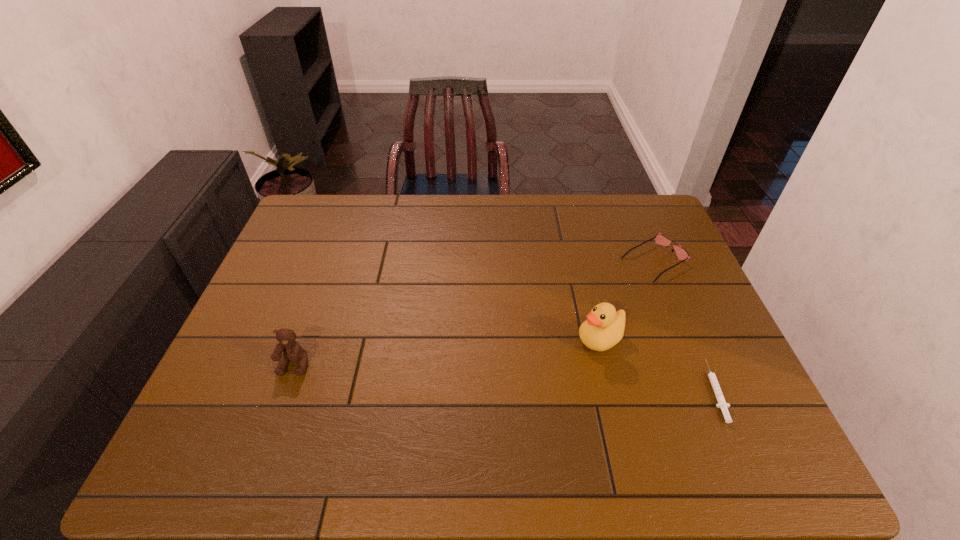
The width and height of the screenshot is (960, 540). What are the coordinates of `vacant point located between the second tallest object and the shortest object` in the screenshot? It's located at (504, 377).

This screenshot has width=960, height=540. Identify the location of vacant space that is in between the tallest object and the teddy bear. (447, 352).

I want to click on free spot between the second shortest object and the duck, so click(x=627, y=300).

The image size is (960, 540). I want to click on free space between the duck and the sunglasses, so click(627, 300).

Locate an element on the screen. vacant region between the duck and the second tallest object is located at coordinates (447, 352).

This screenshot has width=960, height=540. What are the coordinates of `free space between the duck and the teddy bear` in the screenshot? It's located at (447, 352).

Choose which object is the nearest neighbor to the duck. Please provide its 2D coordinates. Your answer should be formatted as a tuple, i.e. [(x, y)], where the tuple contains the x and y coordinates of a point satisfying the conditions above.

[(722, 404)]

Select which object appears as the third closest to the syringe. Please provide its 2D coordinates. Your answer should be formatted as a tuple, i.e. [(x, y)], where the tuple contains the x and y coordinates of a point satisfying the conditions above.

[(291, 349)]

The image size is (960, 540). I want to click on vacant space that satisfies the following two spatial constraints: 1. on the front side of the farthest object; 2. on the right side of the shortest object, so click(x=709, y=390).

The width and height of the screenshot is (960, 540). In order to click on vacant area that satisfies the following two spatial constraints: 1. on the face of the shortest object; 2. on the right side of the third shortest object in this screenshot , I will do `click(285, 390)`.